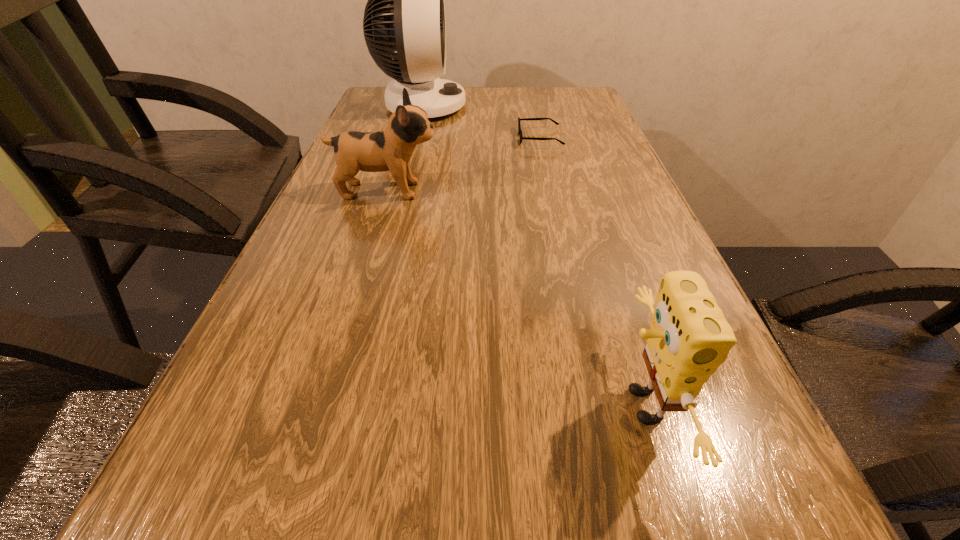
I want to click on free space located 0.360m on the face of the sponge, so click(358, 406).

The width and height of the screenshot is (960, 540). I want to click on vacant area situated on the front-facing side of the sunglasses, so click(x=439, y=138).

The width and height of the screenshot is (960, 540). I want to click on free space located 0.220m on the front-facing side of the sunglasses, so click(x=443, y=138).

You are a GUI agent. You are given a task and a screenshot of the screen. Output one action in this format:
    pyautogui.click(x=<x>, y=<y>)
    Task: Click on the vacant space located 0.140m on the front-facing side of the sunglasses
    The image size is (960, 540).
    Given the screenshot: What is the action you would take?
    pyautogui.click(x=470, y=138)

Identify the location of object that is at the far edge. The height and width of the screenshot is (540, 960). (405, 12).

You are a GUI agent. You are given a task and a screenshot of the screen. Output one action in this format:
    pyautogui.click(x=<x>, y=<y>)
    Task: Click on the fan that is at the left edge
    This screenshot has height=540, width=960.
    Given the screenshot: What is the action you would take?
    pyautogui.click(x=405, y=12)

Locate an element on the screen. puppy situated at the left edge is located at coordinates pyautogui.click(x=390, y=149).

This screenshot has height=540, width=960. Identify the location of sponge that is at the right edge. point(689,338).

This screenshot has width=960, height=540. Find the location of `sunglasses that is at the right edge`. sunglasses that is at the right edge is located at coordinates (519, 127).

At what (x,y) coordinates should I click in order to perform the action: click on object that is positioned at the far left corner. Please return your answer as a coordinate pair (x, y). This screenshot has height=540, width=960. Looking at the image, I should click on (405, 12).